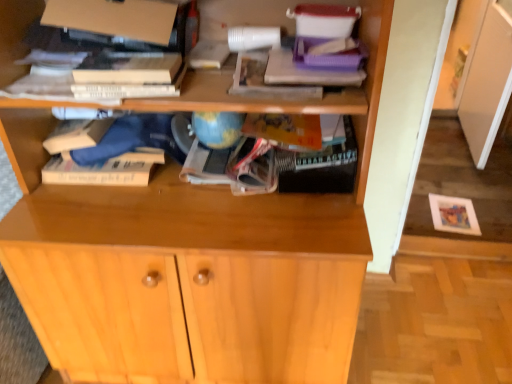
Question: Is light wood cabinet at center touching hardcover book at upper center?

Choices:
 (A) no
 (B) yes

Answer: (A)

Question: Is light wood cabinet at center closer to camera compared to hardcover book at upper center?

Choices:
 (A) yes
 (B) no

Answer: (B)

Question: Does light wood cabinet at center appear on the left side of hardcover book at upper center?

Choices:
 (A) no
 (B) yes

Answer: (A)

Question: From a real-world perspective, is light wood cabinet at center on hardcover book at upper center?

Choices:
 (A) yes
 (B) no

Answer: (B)

Question: Is light wood cabinet at center located outside hardcover book at upper center?

Choices:
 (A) yes
 (B) no

Answer: (A)

Question: Is light wood cabinet at center facing towards hardcover book at upper center?

Choices:
 (A) no
 (B) yes

Answer: (A)

Question: Is hardcover book at upper center next to light wood cabinet at center and touching it?

Choices:
 (A) yes
 (B) no

Answer: (B)

Question: Could you tell me if hardcover book at upper center is turned towards light wood cabinet at center?

Choices:
 (A) yes
 (B) no

Answer: (B)

Question: Is hardcover book at upper center not within light wood cabinet at center?

Choices:
 (A) yes
 (B) no

Answer: (A)

Question: Does hardcover book at upper center have a greater width compared to light wood cabinet at center?

Choices:
 (A) yes
 (B) no

Answer: (B)

Question: Would you say light wood cabinet at center is part of hardcover book at upper center's contents?

Choices:
 (A) yes
 (B) no

Answer: (B)

Question: Can you confirm if hardcover book at upper center is taller than light wood cabinet at center?

Choices:
 (A) yes
 (B) no

Answer: (A)

Question: Is hardcover book at upper center situated inside light wood cabinet at center or outside?

Choices:
 (A) outside
 (B) inside

Answer: (A)